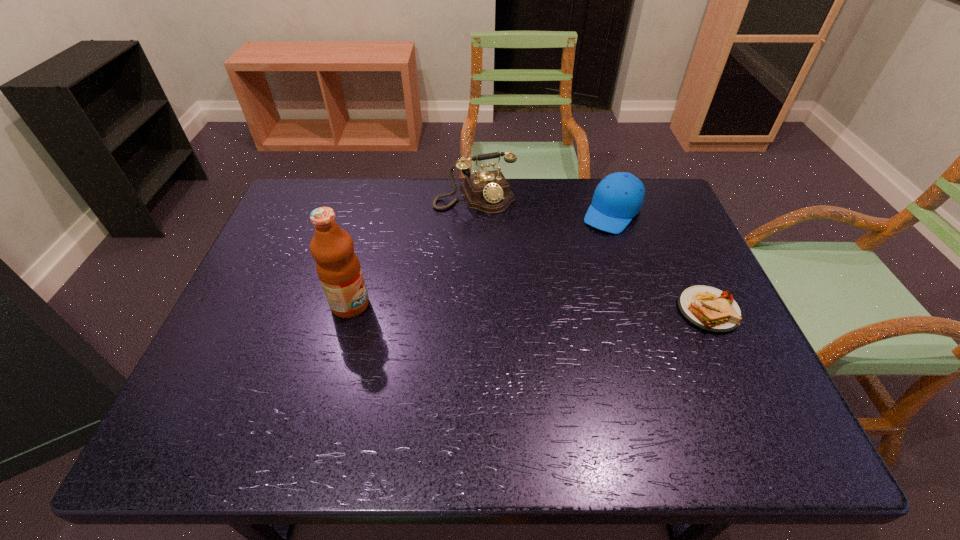
Where is `blank space located 0.060m on the front-facing side of the cap`? The image size is (960, 540). blank space located 0.060m on the front-facing side of the cap is located at coordinates (593, 242).

The image size is (960, 540). Find the location of `free region located on the dial of the telephone`. free region located on the dial of the telephone is located at coordinates (531, 303).

At what (x,y) coordinates should I click in order to perform the action: click on free space located on the dial of the telephone. Please return your answer as a coordinate pair (x, y). Looking at the image, I should click on (493, 228).

Where is `free space located 0.230m on the dial of the telephone`? free space located 0.230m on the dial of the telephone is located at coordinates (512, 265).

Where is `cap present at the far edge`? The image size is (960, 540). cap present at the far edge is located at coordinates coord(618,198).

Find the location of `telephone positioned at the far edge`. telephone positioned at the far edge is located at coordinates (489, 192).

At what (x,y) coordinates should I click in order to perform the action: click on sandwich that is at the right edge. Please return your answer as a coordinate pair (x, y). Looking at the image, I should click on (708, 308).

Find the location of a particular element. cap that is at the right edge is located at coordinates (618, 198).

Locate an element on the screen. Image resolution: width=960 pixels, height=540 pixels. object that is at the far right corner is located at coordinates (618, 198).

Identify the location of vacant space at the far edge. This screenshot has width=960, height=540. (579, 186).